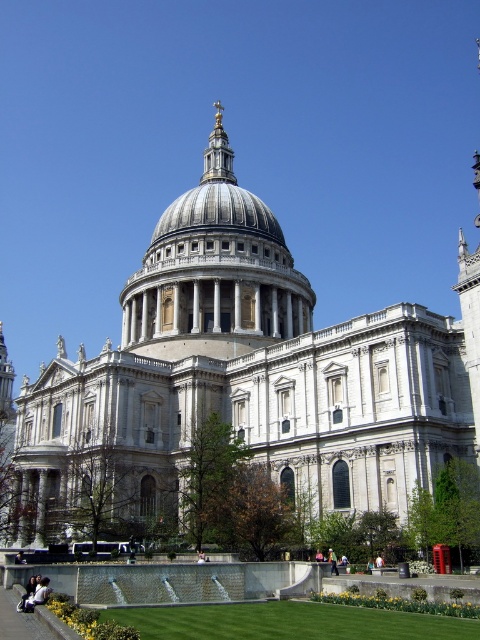
Question: Which point is closer to the camera?

Choices:
 (A) (23, 444)
 (B) (238, 221)

Answer: (A)

Question: Which is nearer to the silver/grey stone dome at center?

Choices:
 (A) white stone cathedral at center
 (B) silver metallic dome at center

Answer: (B)

Question: Considering the relative positions of white stone cathedral at center and silver metallic dome at center in the image provided, where is white stone cathedral at center located with respect to silver metallic dome at center?

Choices:
 (A) below
 (B) above

Answer: (A)

Question: Is white stone cathedral at center in front of silver/grey stone dome at center?

Choices:
 (A) no
 (B) yes

Answer: (B)

Question: Which of these objects is positioned farthest from the silver metallic dome at center?

Choices:
 (A) white stone cathedral at center
 (B) silver/grey stone dome at center

Answer: (A)

Question: Is silver/grey stone dome at center to the left of silver metallic dome at center from the viewer's perspective?

Choices:
 (A) yes
 (B) no

Answer: (B)